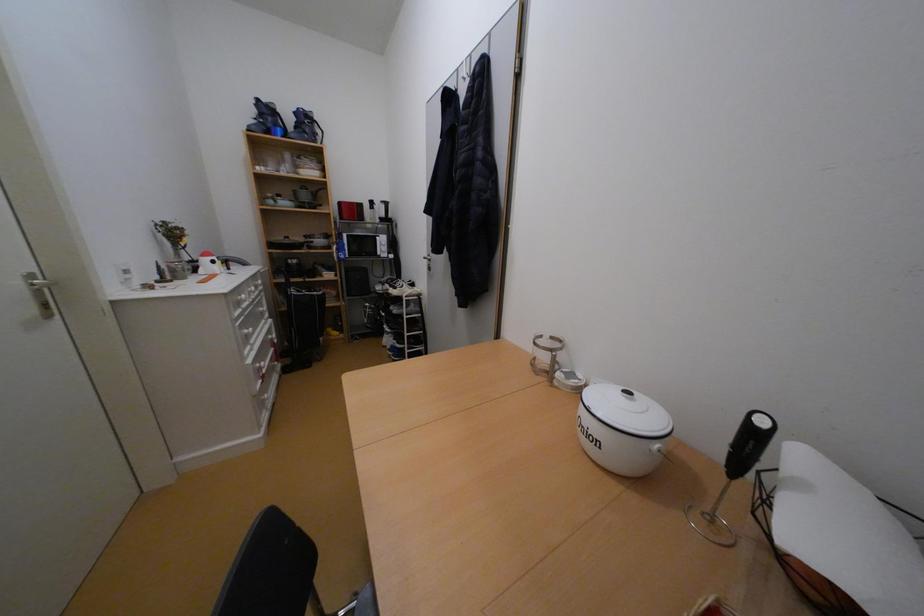
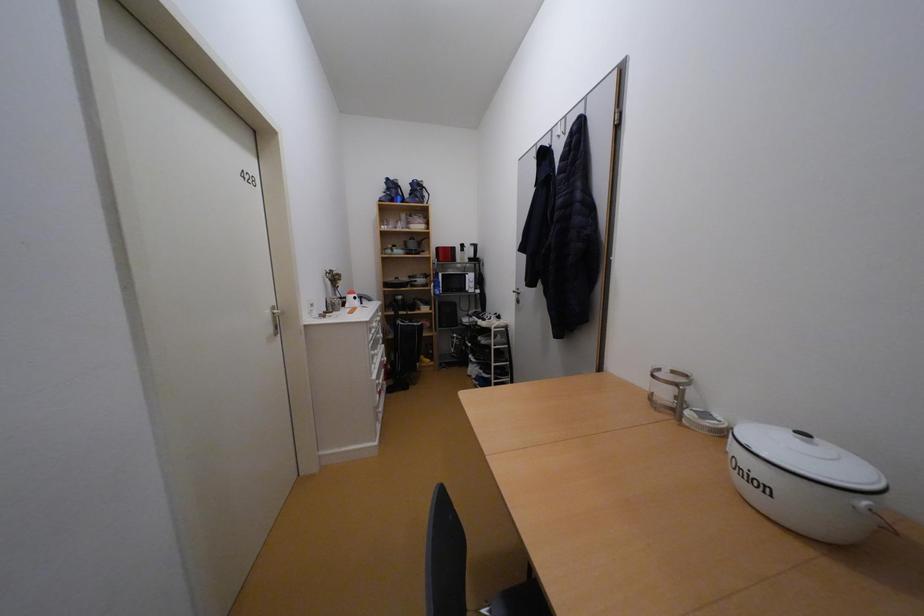
Question: The camera is either moving clockwise (left) or counter-clockwise (right) around the object. The first image is from the beginning of the video and the second image is from the end. Is the camera moving left or right when shooting the video?

Choices:
 (A) Left
 (B) Right

Answer: (B)